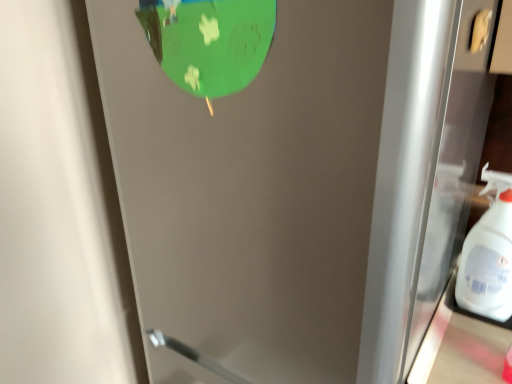
Question: Is satin silver refrigerator at center positioned with its back to white plastic spray bottle at right?

Choices:
 (A) yes
 (B) no

Answer: (B)

Question: Considering the relative positions of satin silver refrigerator at center and white plastic spray bottle at right in the image provided, is satin silver refrigerator at center to the left of white plastic spray bottle at right from the viewer's perspective?

Choices:
 (A) no
 (B) yes

Answer: (B)

Question: Can you confirm if satin silver refrigerator at center is positioned to the right of white plastic spray bottle at right?

Choices:
 (A) yes
 (B) no

Answer: (B)

Question: Does satin silver refrigerator at center come in front of white plastic spray bottle at right?

Choices:
 (A) yes
 (B) no

Answer: (A)

Question: Does satin silver refrigerator at center have a greater height compared to white plastic spray bottle at right?

Choices:
 (A) yes
 (B) no

Answer: (A)

Question: Is satin silver refrigerator at center further to camera compared to white plastic spray bottle at right?

Choices:
 (A) yes
 (B) no

Answer: (B)

Question: Is satin silver refrigerator at center a part of white plastic spray bottle at right?

Choices:
 (A) yes
 (B) no

Answer: (B)

Question: Is the position of white plastic spray bottle at right more distant than that of satin silver refrigerator at center?

Choices:
 (A) no
 (B) yes

Answer: (B)

Question: Is white plastic spray bottle at right positioned beyond the bounds of satin silver refrigerator at center?

Choices:
 (A) no
 (B) yes

Answer: (B)

Question: Is white plastic spray bottle at right with satin silver refrigerator at center?

Choices:
 (A) yes
 (B) no

Answer: (B)

Question: Does white plastic spray bottle at right appear on the right side of satin silver refrigerator at center?

Choices:
 (A) yes
 (B) no

Answer: (A)

Question: Does white plastic spray bottle at right have a lesser height compared to satin silver refrigerator at center?

Choices:
 (A) no
 (B) yes

Answer: (B)

Question: Would you say white plastic spray bottle at right is to the left or to the right of satin silver refrigerator at center in the picture?

Choices:
 (A) left
 (B) right

Answer: (B)